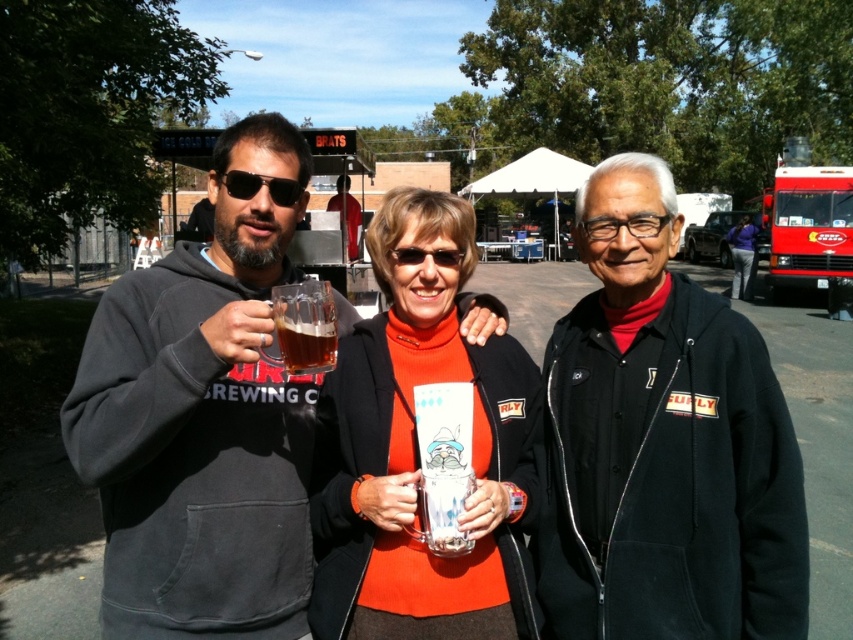
Question: Which object appears closest to the camera in this image?

Choices:
 (A) matte ceramic mug at center
 (B) matte black hoodie at left
 (C) black matte jacket at center

Answer: (B)

Question: Can you confirm if black matte jacket at center is positioned to the left of matte black sunglasses at left?

Choices:
 (A) yes
 (B) no

Answer: (B)

Question: Considering the relative positions of matte black hoodie at left and matte black sunglasses at left in the image provided, where is matte black hoodie at left located with respect to matte black sunglasses at left?

Choices:
 (A) left
 (B) right

Answer: (A)

Question: Which object appears closest to the camera in this image?

Choices:
 (A) matte ceramic mug at center
 (B) black plastic goggles at center
 (C) matte black sunglasses at left
 (D) translucent glass mug at center

Answer: (D)

Question: Can you confirm if matte black hoodie at left is positioned to the right of translucent glass mug at center?

Choices:
 (A) no
 (B) yes

Answer: (A)

Question: Which point is farther to the camera?

Choices:
 (A) black matte jacket at center
 (B) black plastic goggles at center
 (C) translucent glass mug at center
 (D) matte ceramic mug at center

Answer: (B)